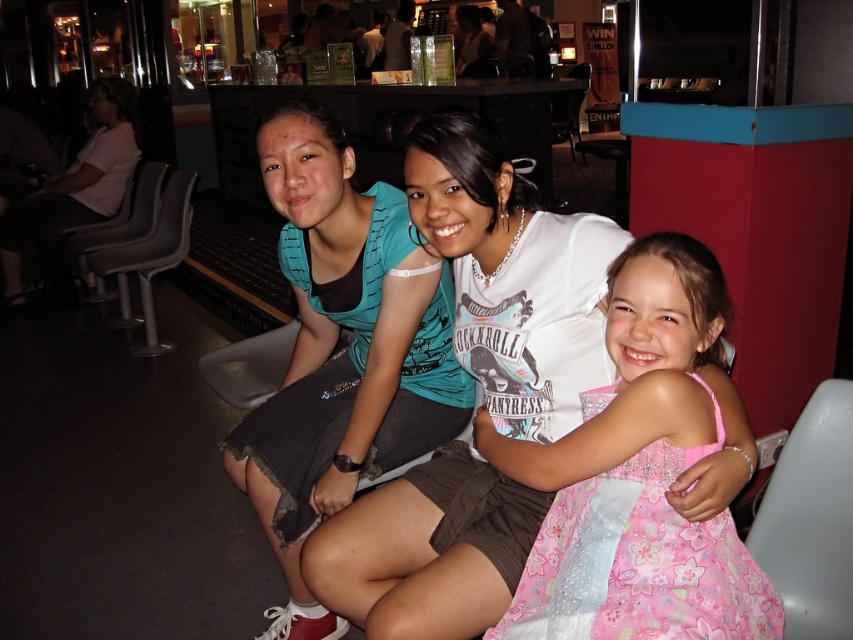
You are sitting at the white plastic chair at lower right and want to move to the white plastic chair at center. Can you stand up and walk directly to it without moving around any other chairs?

The white plastic chair at lower right is below the white plastic chair at center, meaning they are aligned vertically. Since they are in a straight line, you can stand up and walk directly to the white plastic chair at center without needing to move around other chairs.

You are a photographer trying to capture a candid shot of the matte white shirt at upper left and the gray plastic chair at left. Which object should you focus on first to ensure it appears in the foreground of your photo?

The matte white shirt at upper left is located above the gray plastic chair at left, so focusing on the matte white shirt at upper left first will place it in the foreground since it is higher up in the frame.

You are a photographer trying to capture a candid shot of the teal fabric shirt at center. You notice that the point at coordinate (341,349) is where you want to focus. Based on the scene description, can you confirm if this point aligns with the teal fabric shirt at center?

Yes, the point at coordinate (341,349) corresponds to the teal fabric shirt at center, so focusing there will capture the desired subject.